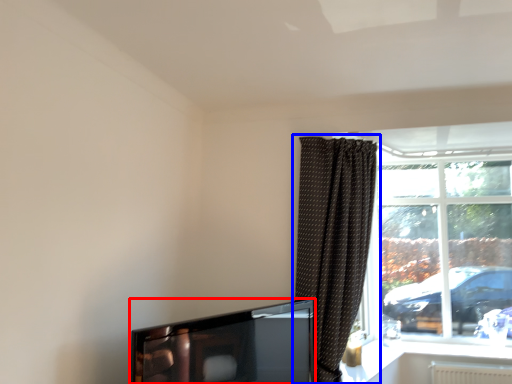
Question: Among these objects, which one is nearest to the camera, television (highlighted by a red box) or curtain (highlighted by a blue box)?

Choices:
 (A) television
 (B) curtain

Answer: (A)